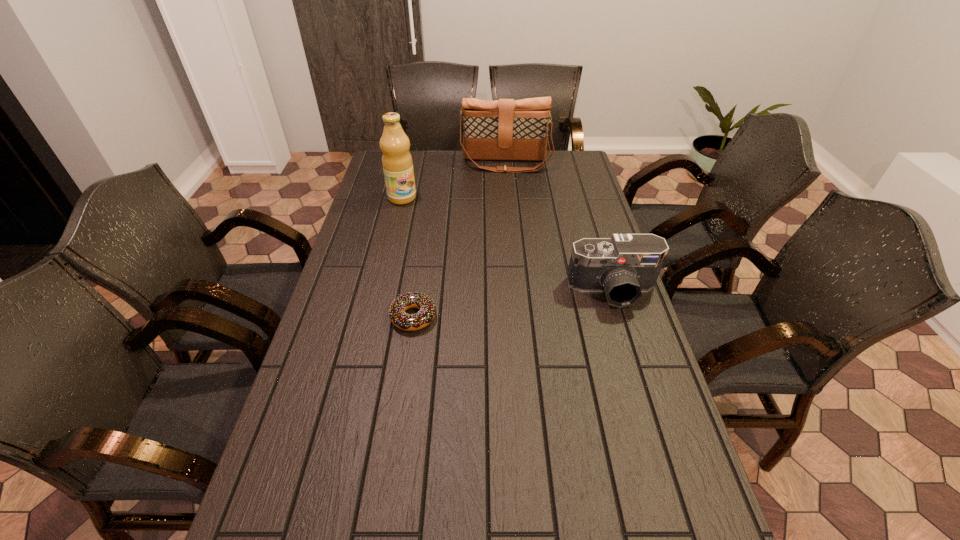
In the image, there is a desktop. Where is `vacant space at the near edge`? The width and height of the screenshot is (960, 540). vacant space at the near edge is located at coordinates (463, 509).

Identify the location of blank space at the left edge. The image size is (960, 540). (355, 220).

Identify the location of free region at the right edge of the desktop. The height and width of the screenshot is (540, 960). (636, 331).

Find the location of `vacant space that is in between the shortest object and the olive oil`. vacant space that is in between the shortest object and the olive oil is located at coordinates (408, 257).

You are a GUI agent. You are given a task and a screenshot of the screen. Output one action in this format:
    pyautogui.click(x=<x>, y=<y>)
    Task: Click on the vacant point located between the olive oil and the doughnut
    The height and width of the screenshot is (540, 960).
    Given the screenshot: What is the action you would take?
    pyautogui.click(x=408, y=257)

Identify the location of unoccupied position between the farthest object and the second farthest object. (454, 180).

The image size is (960, 540). Identify the location of free space that is in between the olive oil and the second shortest object. (508, 244).

Image resolution: width=960 pixels, height=540 pixels. Identify the location of free point between the second farthest object and the shoulder bag. (454, 180).

What are the coordinates of `vacant space in between the camera and the second farthest object` in the screenshot? It's located at (508, 244).

Where is `vacant area that lies between the third nearest object and the shoulder bag`? This screenshot has width=960, height=540. vacant area that lies between the third nearest object and the shoulder bag is located at coordinates point(454,180).